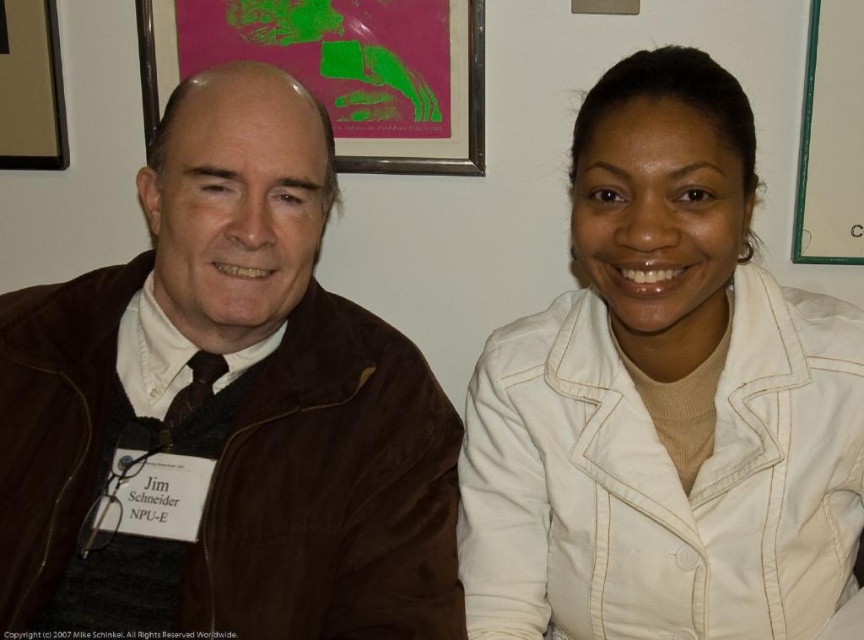
You are an interior designer assessing the wall space in this professional setting. You need to hang a new artwork that is the same height as the pink paper at upper center. Considering the brown suede jacket at left, which is taller than the pink paper, can you determine if there is enough vertical space between the two existing artworks to accommodate the new piece without overlapping?

The brown suede jacket at left is much taller than the pink paper at upper center. Since the new artwork would be the same height as the pink paper at upper center, there should be sufficient vertical space between the two existing artworks to accommodate it without overlapping, as the taller brown suede jacket at left does not block this area.

You are a photographer setting up for a group photo. You need to ensure that the brown suede jacket at left and the pink paper at upper center are both visible in the frame. Given that the camera has a focal length of 50mm, what is the minimum distance you should position the camera from the subjects to capture both objects in the frame without cropping?

The brown suede jacket at left is 73.02 centimeters away from the pink paper at upper center. To capture both in the frame with a 50mm lens, the camera should be positioned at least 73.02 centimeters away to ensure both objects are within the field of view.

You are an interior designer who wants to hang a new decoration between the pink paper at upper center and the brown wooden picture frame at upper left. Based on their sizes, which object should you place closer to the center of the wall?

The pink paper at upper center has a larger size compared to the brown wooden picture frame at upper left. Therefore, to balance the composition, you should place the pink paper at upper center closer to the center of the wall since its larger size can anchor the central area effectively.